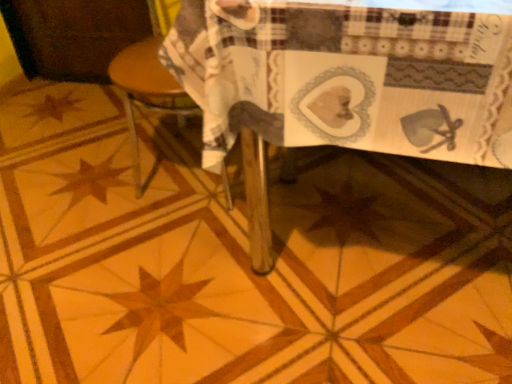
Where is `vacant space underneath wooden table at center (from a real-world perspective)`? This screenshot has width=512, height=384. vacant space underneath wooden table at center (from a real-world perspective) is located at coordinates (366, 236).